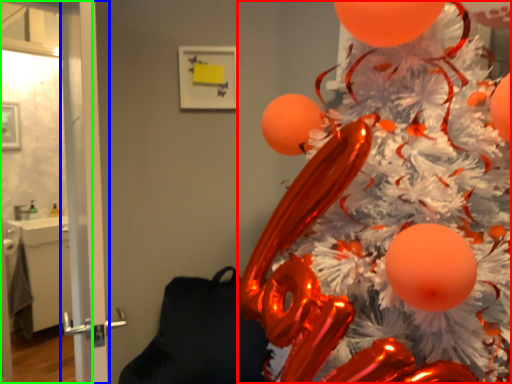
Question: Which is farther away from christmas tree (highlighted by a red box)? screen door (highlighted by a blue box) or screen door (highlighted by a green box)?

Choices:
 (A) screen door
 (B) screen door

Answer: (A)